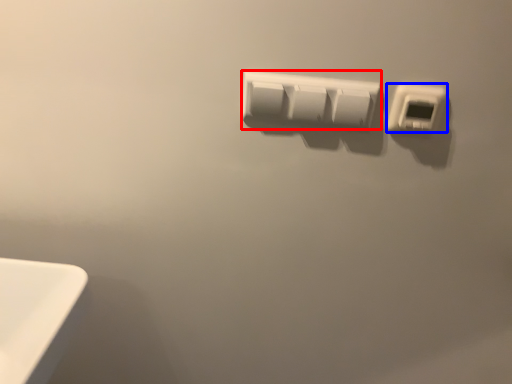
Question: Which of the following is the closest to the observer, power plugs and sockets (highlighted by a red box) or power plugs and sockets (highlighted by a blue box)?

Choices:
 (A) power plugs and sockets
 (B) power plugs and sockets

Answer: (B)